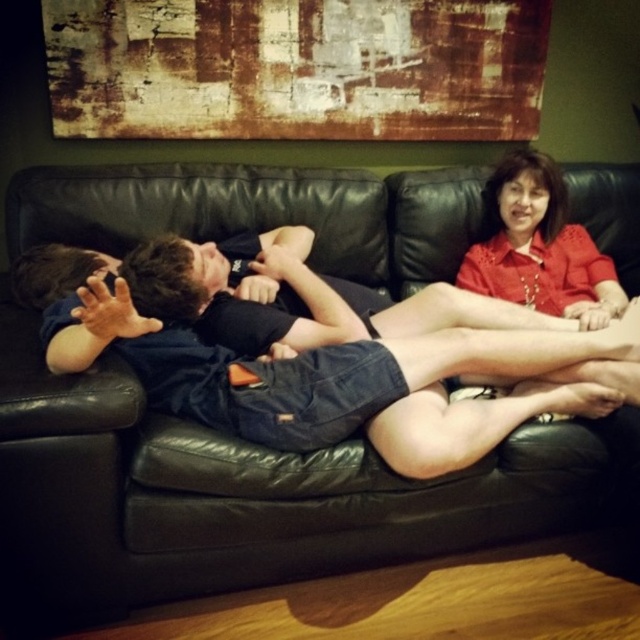
Question: Which object is positioned farthest from the denim shorts at center?

Choices:
 (A) matte red blouse at upper right
 (B) black leather couch at center

Answer: (A)

Question: Is black leather couch at center to the left of matte red blouse at upper right from the viewer's perspective?

Choices:
 (A) yes
 (B) no

Answer: (A)

Question: Which of the following is the farthest from the observer?

Choices:
 (A) (356, 376)
 (B) (22, 547)
 (C) (563, 250)

Answer: (C)

Question: Does black leather couch at center have a lesser width compared to matte red blouse at upper right?

Choices:
 (A) no
 (B) yes

Answer: (A)

Question: Does black leather couch at center have a smaller size compared to denim shorts at center?

Choices:
 (A) no
 (B) yes

Answer: (A)

Question: Estimate the real-world distances between objects in this image. Which object is farther from the black leather couch at center?

Choices:
 (A) matte red blouse at upper right
 (B) denim shorts at center

Answer: (A)